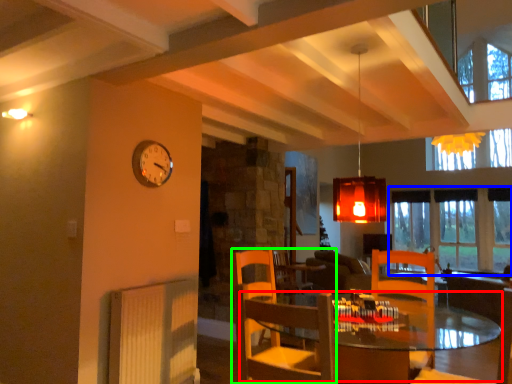
Question: Based on their relative distances, which object is farther from table (highlighted by a red box)? Choose from window (highlighted by a blue box) and chair (highlighted by a green box).

Choices:
 (A) window
 (B) chair

Answer: (B)